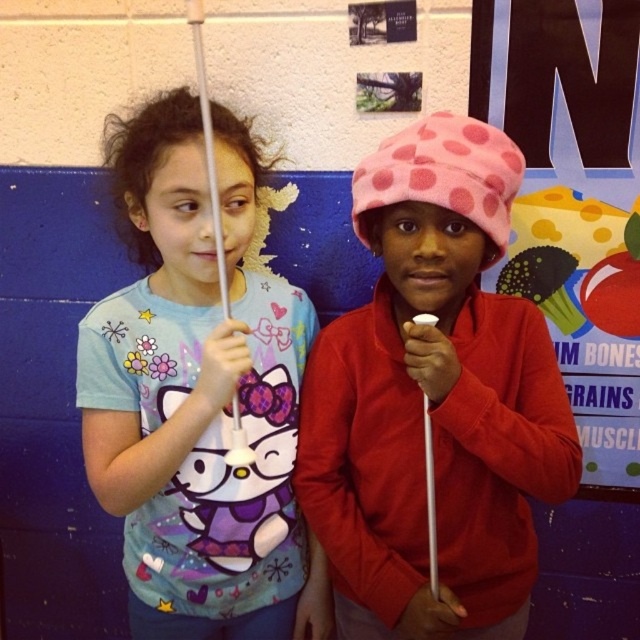
Question: Can you confirm if matte white cane at center is positioned to the left of polka dot fabric hat at upper right?

Choices:
 (A) yes
 (B) no

Answer: (A)

Question: Can you confirm if matte white cane at center is bigger than polka dot fabric hat at upper right?

Choices:
 (A) no
 (B) yes

Answer: (B)

Question: Is pink fleece hat at center behind matte white cane at center?

Choices:
 (A) no
 (B) yes

Answer: (A)

Question: Which point appears closest to the camera in this image?

Choices:
 (A) (547, 232)
 (B) (381, 564)
 (C) (161, 531)

Answer: (B)

Question: Estimate the real-world distances between objects in this image. Which object is closer to the pink fleece hat at center?

Choices:
 (A) polka dot fabric hat at upper right
 (B) matte white cane at center

Answer: (B)

Question: Which object appears farthest from the camera in this image?

Choices:
 (A) polka dot fabric hat at upper right
 (B) matte white cane at center
 (C) pink fleece hat at center

Answer: (A)